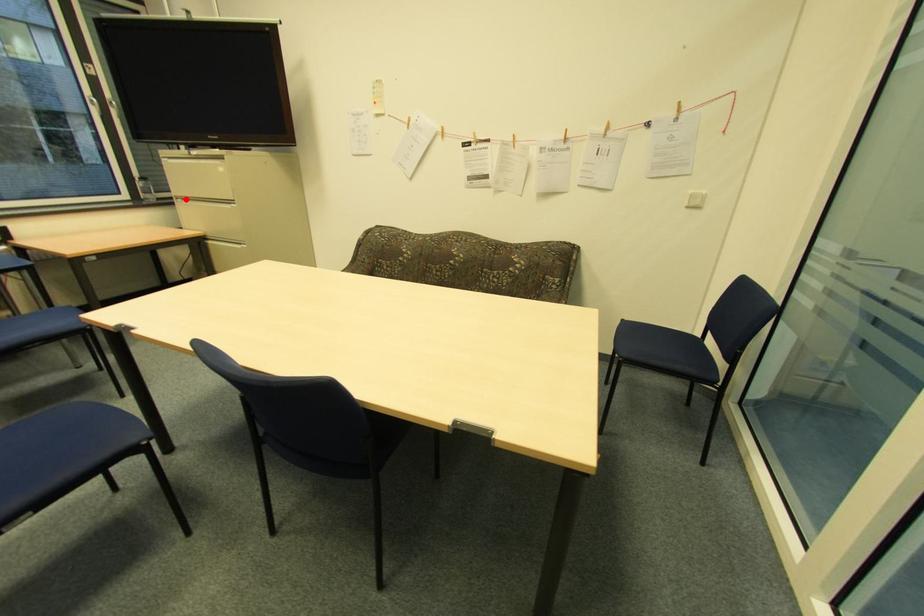
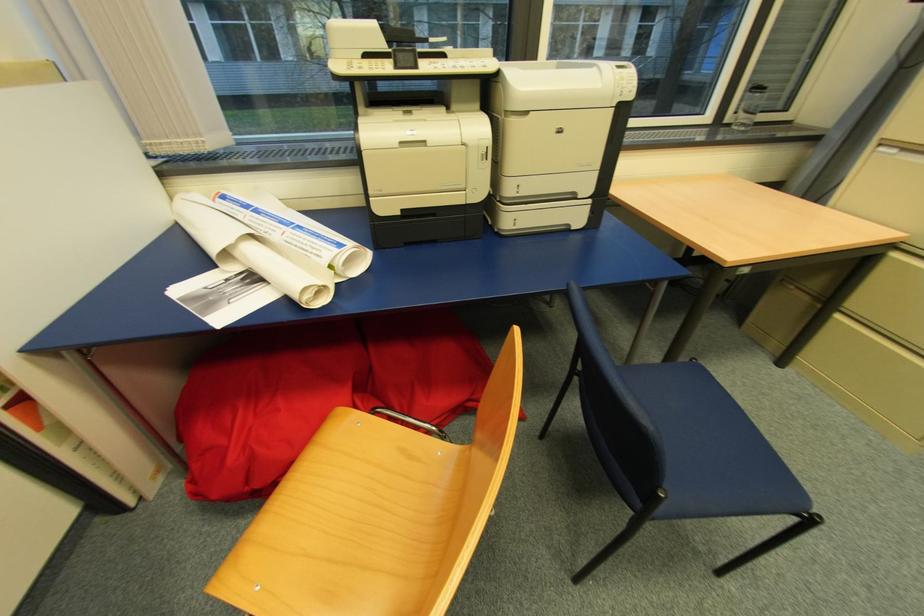
Question: I am providing you with two images of the same scene from different viewpoints. A red point is shown in image1. For the corresponding object point in image2, is it positioned nearer or farther from the camera?

Choices:
 (A) Nearer
 (B) Farther

Answer: (B)